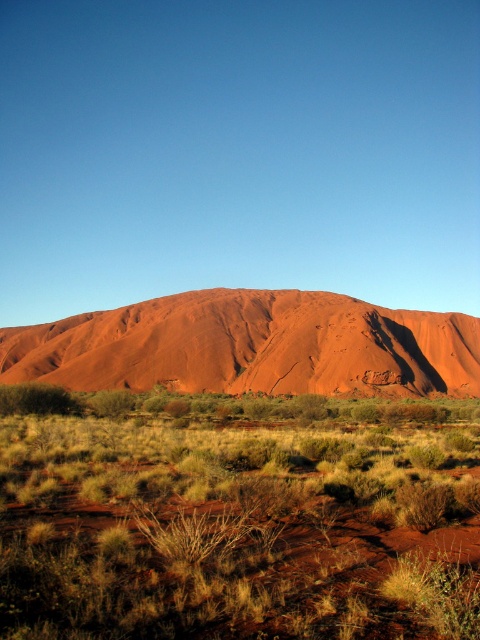
In the scene shown: Does dry grass at lower center have a lesser width compared to rustic sandstone mountain at center?

Correct, dry grass at lower center's width is less than rustic sandstone mountain at center's.

Between dry grass at lower center and rustic sandstone mountain at center, which one is positioned lower?

dry grass at lower center is below.

Describe the element at coordinates (238, 518) in the screenshot. The width and height of the screenshot is (480, 640). I see `dry grass at lower center` at that location.

Image resolution: width=480 pixels, height=640 pixels. Find the location of `dry grass at lower center`. dry grass at lower center is located at coordinates (238, 518).